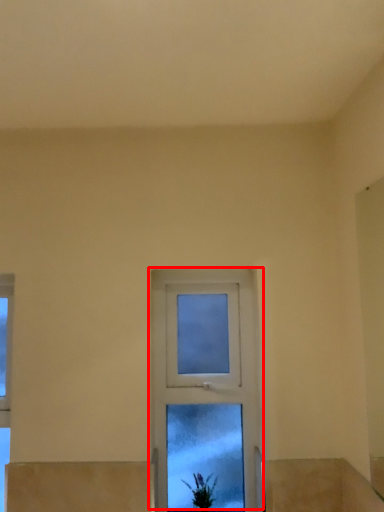
Question: From the image's perspective, where is window (annotated by the red box) located relative to houseplant?

Choices:
 (A) above
 (B) below

Answer: (A)